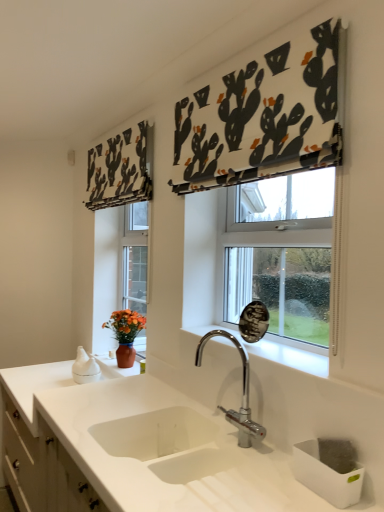
The width and height of the screenshot is (384, 512). Identify the location of black fabric cactus-patterned curtain at upper left, the first curtain from the back. point(121,169).

This screenshot has height=512, width=384. What do you see at coordinates (243, 392) in the screenshot?
I see `chrome metallic faucet at center` at bounding box center [243, 392].

Describe the element at coordinates (42, 468) in the screenshot. I see `white glossy cabinet at lower left` at that location.

Where is `black fabric cactus-patterned curtain at upper left, which is the second curtain from right to left`? black fabric cactus-patterned curtain at upper left, which is the second curtain from right to left is located at coordinates (121, 169).

From the image's perspective, which is above, white glossy sink at center or black fabric cactus-patterned curtain at upper left, arranged as the second curtain when viewed from the front?

black fabric cactus-patterned curtain at upper left, arranged as the second curtain when viewed from the front.

Is white glossy sink at center not within black fabric cactus-patterned curtain at upper left, the first curtain from the back?

Yes, white glossy sink at center is located beyond the bounds of black fabric cactus-patterned curtain at upper left, the first curtain from the back.

Measure the distance between white glossy sink at center and black fabric cactus-patterned curtain at upper left, arranged as the second curtain when viewed from the front.

white glossy sink at center is 1.30 meters from black fabric cactus-patterned curtain at upper left, arranged as the second curtain when viewed from the front.

Locate an element on the screen. the 2nd curtain to the left when counting from the white glossy sink at center is located at coordinates (121, 169).

From the image's perspective, does chrome metallic faucet at center appear lower than orange matte vase at left?

No, from the image's perspective, chrome metallic faucet at center is not beneath orange matte vase at left.

From a real-world perspective, is chrome metallic faucet at center positioned above or below orange matte vase at left?

Clearly, from a real-world perspective, chrome metallic faucet at center is above orange matte vase at left.

Is orange matte vase at left located within chrome metallic faucet at center?

Definitely not — orange matte vase at left is not inside chrome metallic faucet at center.

Looking at this image, can you see chrome metallic faucet at center touching orange matte vase at left?

No, chrome metallic faucet at center is not making contact with orange matte vase at left.

Does white fabric with cactus print at upper center, marked as the 1th curtain in a front-to-back arrangement, touch white glossy sink at center?

No, white fabric with cactus print at upper center, marked as the 1th curtain in a front-to-back arrangement, is not making contact with white glossy sink at center.

Could you tell me if white fabric with cactus print at upper center, placed as the 2th curtain when sorted from left to right, is turned towards white glossy sink at center?

No, white fabric with cactus print at upper center, placed as the 2th curtain when sorted from left to right, does not turn towards white glossy sink at center.

Is white fabric with cactus print at upper center, marked as the 1th curtain in a front-to-back arrangement, taller than white glossy sink at center?

Yes, white fabric with cactus print at upper center, marked as the 1th curtain in a front-to-back arrangement, is taller than white glossy sink at center.

How much distance is there between white glossy sink at center and white fabric with cactus print at upper center, marked as the 1th curtain in a front-to-back arrangement?

white glossy sink at center and white fabric with cactus print at upper center, marked as the 1th curtain in a front-to-back arrangement, are 31.98 inches apart.

From a real-world perspective, between white glossy sink at center and white fabric with cactus print at upper center, marked as the 1th curtain in a front-to-back arrangement, who is vertically higher?

In real-world perspective, white fabric with cactus print at upper center, marked as the 1th curtain in a front-to-back arrangement, is above.

Is white glossy sink at center not close to white fabric with cactus print at upper center, placed as the 2th curtain when sorted from left to right?

No, white glossy sink at center is in close proximity to white fabric with cactus print at upper center, placed as the 2th curtain when sorted from left to right.

In terms of height, does white glossy sink at center look taller or shorter compared to white fabric with cactus print at upper center, the 1th curtain from the right?

white glossy sink at center is shorter than white fabric with cactus print at upper center, the 1th curtain from the right.

In the scene shown: How far apart are black fabric cactus-patterned curtain at upper left, the first curtain when ordered from left to right, and white glossy sink at center?

4.28 feet.

Can white glossy sink at center be found inside black fabric cactus-patterned curtain at upper left, the first curtain when ordered from left to right?

That's incorrect, white glossy sink at center is not inside black fabric cactus-patterned curtain at upper left, the first curtain when ordered from left to right.

Considering the relative positions of black fabric cactus-patterned curtain at upper left, which is the second curtain from right to left, and white glossy sink at center in the image provided, is black fabric cactus-patterned curtain at upper left, which is the second curtain from right to left, in front of white glossy sink at center?

No, black fabric cactus-patterned curtain at upper left, which is the second curtain from right to left, is further to the viewer.

Is black fabric cactus-patterned curtain at upper left, the first curtain when ordered from left to right, bigger than white glossy sink at center?

Correct, black fabric cactus-patterned curtain at upper left, the first curtain when ordered from left to right, is larger in size than white glossy sink at center.

In order to click on floral arrangement that appears below the white glossy sink at center (from the image's perspective) in this screenshot , I will do `click(125, 334)`.

Considering the sizes of white glossy sink at center and orange matte vase at left in the image, is white glossy sink at center taller or shorter than orange matte vase at left?

Clearly, white glossy sink at center is shorter compared to orange matte vase at left.

Considering the relative sizes of white glossy sink at center and orange matte vase at left in the image provided, is white glossy sink at center bigger than orange matte vase at left?

Incorrect, white glossy sink at center is not larger than orange matte vase at left.

From a real-world perspective, is black fabric cactus-patterned curtain at upper left, the first curtain when ordered from left to right, positioned under white glossy cabinet at lower left based on gravity?

Incorrect, from a real-world perspective, black fabric cactus-patterned curtain at upper left, the first curtain when ordered from left to right, is higher than white glossy cabinet at lower left.

Is the surface of black fabric cactus-patterned curtain at upper left, the first curtain when ordered from left to right, in direct contact with white glossy cabinet at lower left?

black fabric cactus-patterned curtain at upper left, the first curtain when ordered from left to right, and white glossy cabinet at lower left are clearly separated.

Where is `cabinetry below the black fabric cactus-patterned curtain at upper left, arranged as the second curtain when viewed from the front (from the image's perspective)`? The width and height of the screenshot is (384, 512). cabinetry below the black fabric cactus-patterned curtain at upper left, arranged as the second curtain when viewed from the front (from the image's perspective) is located at coordinates (42, 468).

From the image's perspective, is black fabric cactus-patterned curtain at upper left, arranged as the second curtain when viewed from the front, positioned above or below white glossy cabinet at lower left?

Clearly, from the image's perspective, black fabric cactus-patterned curtain at upper left, arranged as the second curtain when viewed from the front, is above white glossy cabinet at lower left.

Identify the location of window sill on the right of black fabric cactus-patterned curtain at upper left, which is the second curtain from right to left. This screenshot has width=384, height=512. (288, 355).

Identify the location of tap in front of the orange matte vase at left. (243, 392).

In the scene shown: From the image, which object appears to be nearer to white glossy sink at center, chrome metallic faucet at center or black fabric cactus-patterned curtain at upper left, the first curtain when ordered from left to right?

Among the two, chrome metallic faucet at center is located nearer to white glossy sink at center.

When comparing their distances from white glossy cabinet at lower left, does white glossy sink at center or orange matte vase at left seem closer?

The object closer to white glossy cabinet at lower left is orange matte vase at left.

Based on their spatial positions, is chrome metallic faucet at center or white glossy cabinet at lower left closer to white glossy sink at center?

chrome metallic faucet at center lies closer to white glossy sink at center than the other object.

From the image, which object appears to be nearer to orange matte vase at left, chrome metallic faucet at center or white fabric with cactus print at upper center, acting as the second curtain starting from the back?

chrome metallic faucet at center lies closer to orange matte vase at left than the other object.

Considering their positions, is white fabric with cactus print at upper center, marked as the 1th curtain in a front-to-back arrangement, positioned further to orange matte vase at left than black fabric cactus-patterned curtain at upper left, the first curtain when ordered from left to right?

white fabric with cactus print at upper center, marked as the 1th curtain in a front-to-back arrangement.

Based on their spatial positions, is white fabric with cactus print at upper center, marked as the 1th curtain in a front-to-back arrangement, or white glossy sink at center further from black fabric cactus-patterned curtain at upper left, the first curtain when ordered from left to right?

white glossy sink at center lies further to black fabric cactus-patterned curtain at upper left, the first curtain when ordered from left to right, than the other object.

Which object lies nearer to the anchor point white glossy sink at center, white glossy cabinet at lower left or orange matte vase at left?

white glossy cabinet at lower left is closer to white glossy sink at center.

Considering their positions, is white fabric with cactus print at upper center, acting as the second curtain starting from the back, positioned further to white glossy cabinet at lower left than white glossy sink at center?

Among the two, white fabric with cactus print at upper center, acting as the second curtain starting from the back, is located further to white glossy cabinet at lower left.

Locate an element on the screen. window sill between black fabric cactus-patterned curtain at upper left, arranged as the second curtain when viewed from the front, and white glossy cabinet at lower left from top to bottom is located at coordinates (288, 355).

Locate an element on the screen. This screenshot has height=512, width=384. window sill between black fabric cactus-patterned curtain at upper left, the first curtain from the back, and chrome metallic faucet at center from top to bottom is located at coordinates (288, 355).

Locate an element on the screen. curtain that lies between black fabric cactus-patterned curtain at upper left, which is the second curtain from right to left, and chrome metallic faucet at center from top to bottom is located at coordinates (265, 115).

The width and height of the screenshot is (384, 512). I want to click on tap that lies between black fabric cactus-patterned curtain at upper left, which is the second curtain from right to left, and white glossy cabinet at lower left from top to bottom, so click(243, 392).